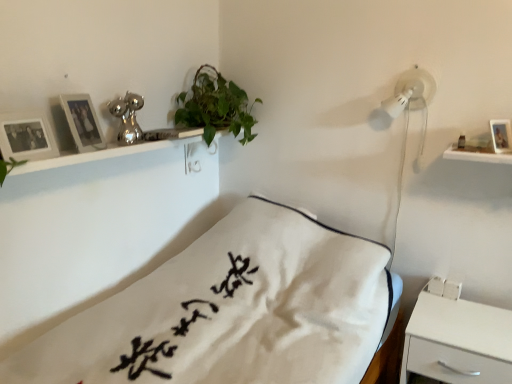
Question: Looking at the image, does wooden photo frame at upper left, the first picture frame in the left-to-right sequence, seem bigger or smaller compared to matte silver picture frame at upper left, which ranks as the 2th picture frame in left-to-right order?

Choices:
 (A) small
 (B) big

Answer: (B)

Question: From the image's perspective, is wooden photo frame at upper left, the 3th picture frame from the right, above or below matte silver picture frame at upper left, which ranks as the 2th picture frame in left-to-right order?

Choices:
 (A) above
 (B) below

Answer: (B)

Question: Which object is the closest to the wooden photo frame at upper right, which is the 1th picture frame in right-to-left order?

Choices:
 (A) white matte nightstand at lower right
 (B) green leafy plant at upper center
 (C) wooden photo frame at upper left, the 3th picture frame from the right
 (D) white cotton pillow at center
 (E) matte silver picture frame at upper left, which ranks as the 2th picture frame in left-to-right order

Answer: (A)

Question: Which is nearer to the wooden photo frame at upper left, the 3th picture frame from the right?

Choices:
 (A) wooden photo frame at upper right, the 3th picture frame when ordered from left to right
 (B) white matte nightstand at lower right
 (C) matte silver picture frame at upper left, which ranks as the 2th picture frame in left-to-right order
 (D) green leafy plant at upper center
 (E) white cotton pillow at center

Answer: (C)